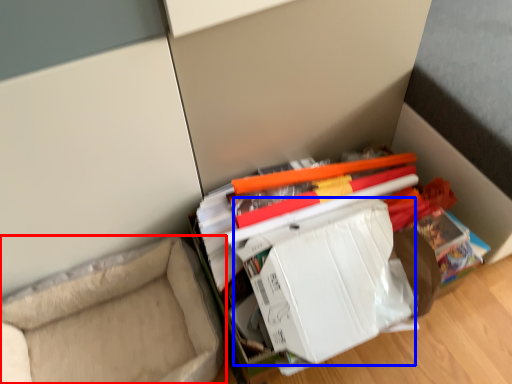
Question: Which of the following is the closest to the observer, furniture (highlighted by a red box) or paperback book (highlighted by a blue box)?

Choices:
 (A) furniture
 (B) paperback book

Answer: (B)